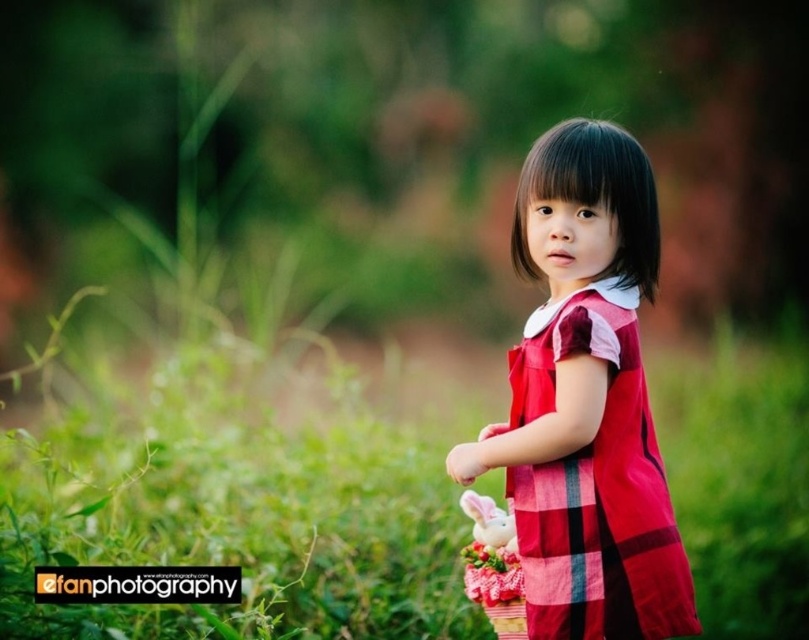
Who is shorter, red plaid dress at center or fluffy pink flower at center?

fluffy pink flower at center is shorter.

Can you confirm if red plaid dress at center is positioned above fluffy pink flower at center?

Yes, red plaid dress at center is above fluffy pink flower at center.

Is point (575, 122) positioned in front of point (511, 579)?

Yes.

Locate an element on the screen. This screenshot has height=640, width=809. red plaid dress at center is located at coordinates (587, 400).

Can you confirm if green grass at center is wider than red plaid dress at center?

Yes, green grass at center is wider than red plaid dress at center.

Does green grass at center appear under red plaid dress at center?

Correct, green grass at center is located below red plaid dress at center.

Between point (168, 618) and point (507, 364), which one is positioned behind?

Point (168, 618)

Image resolution: width=809 pixels, height=640 pixels. I want to click on green grass at center, so click(235, 513).

Who is more forward, (x=687, y=486) or (x=502, y=577)?

Point (x=502, y=577)

Can you confirm if green grass at center is positioned to the right of fluffy pink flower at center?

In fact, green grass at center is to the left of fluffy pink flower at center.

This screenshot has height=640, width=809. What do you see at coordinates (235, 513) in the screenshot?
I see `green grass at center` at bounding box center [235, 513].

This screenshot has height=640, width=809. I want to click on green grass at center, so click(x=235, y=513).